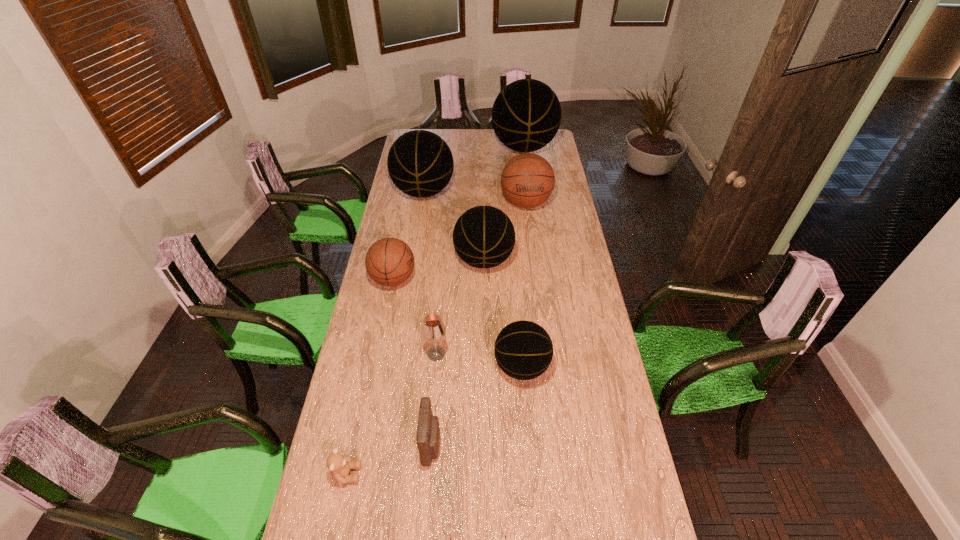
In order to click on the biggest black basketball in this screenshot , I will do `click(526, 115)`.

Identify the location of the farthest object. (526, 115).

The height and width of the screenshot is (540, 960). In order to click on the third smallest black basketball in this screenshot , I will do point(420,163).

Where is `the fifth shortest basketball`? This screenshot has width=960, height=540. the fifth shortest basketball is located at coordinates (420, 163).

I want to click on the farther brown basketball, so [x=527, y=180].

At what (x,y) coordinates should I click in order to perform the action: click on the right brown basketball. Please return your answer as a coordinate pair (x, y). Looking at the image, I should click on (527, 180).

In order to click on the third biggest black basketball in this screenshot , I will do `click(484, 237)`.

Locate an element on the screen. the smaller brown basketball is located at coordinates (389, 261).

Locate an element on the screen. This screenshot has width=960, height=540. the nearer brown basketball is located at coordinates (389, 261).

Where is `the smallest black basketball`? This screenshot has height=540, width=960. the smallest black basketball is located at coordinates (523, 350).